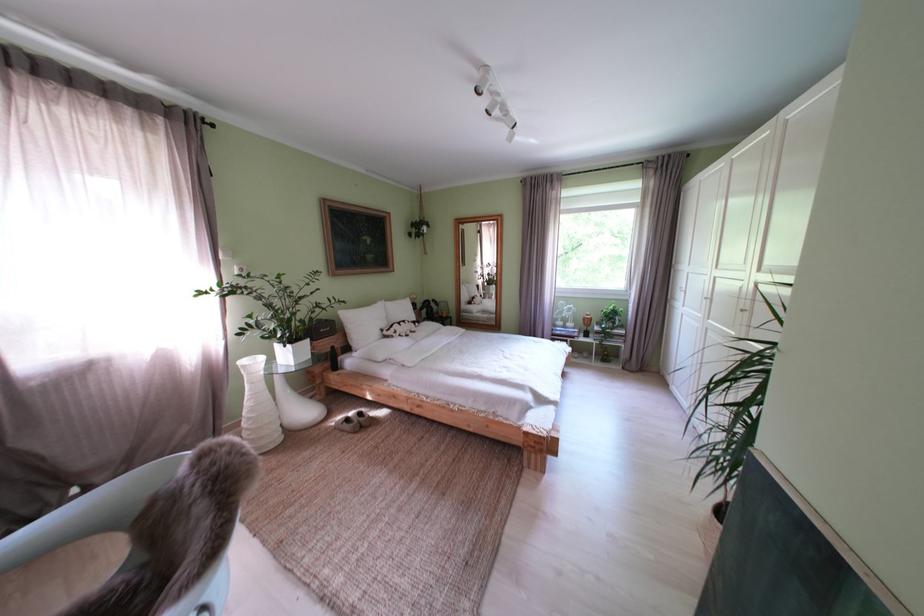
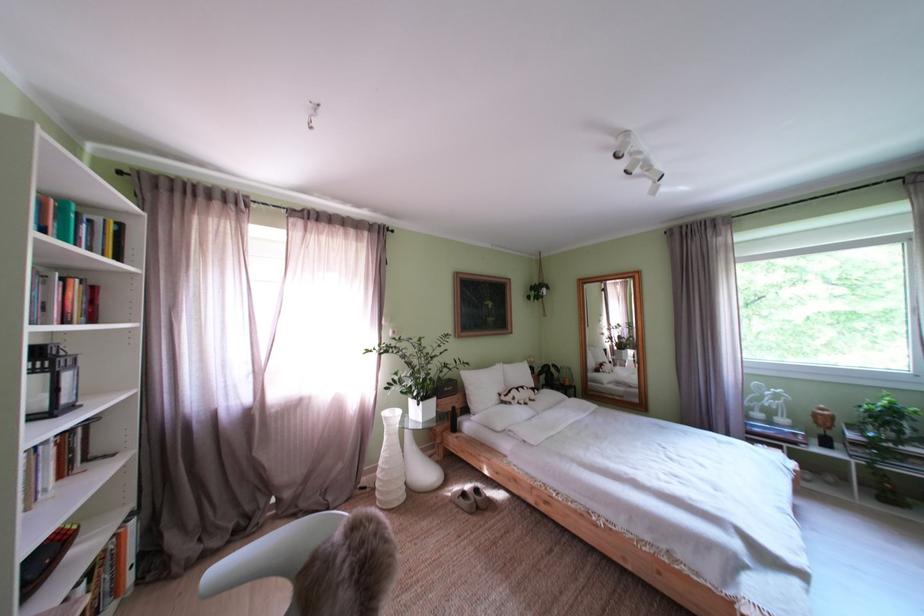
The point at (259, 408) is marked in the first image. Where is the corresponding point in the second image?

(395, 460)